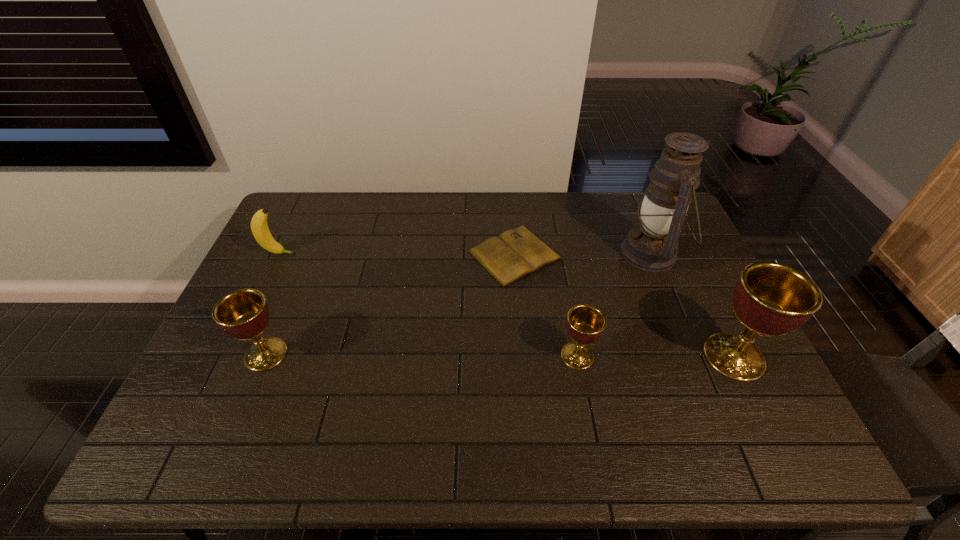
Point out which chalice is positioned as the third nearest to the shortest object. Please provide its 2D coordinates. Your answer should be formatted as a tuple, i.e. [(x, y)], where the tuple contains the x and y coordinates of a point satisfying the conditions above.

[(243, 314)]

I want to click on chalice that is the second nearest to the second chalice from right to left, so click(x=243, y=314).

Identify the location of vacant space that satisfies the following two spatial constraints: 1. from the stem of the shortest object; 2. on the right side of the banana. (278, 255).

Identify the location of free spot that satisfies the following two spatial constraints: 1. from the stem of the banana; 2. on the right side of the leftmost chalice. Image resolution: width=960 pixels, height=540 pixels. 231,354.

This screenshot has height=540, width=960. What are the coordinates of `vacant space that satisfies the following two spatial constraints: 1. on the back side of the book; 2. from the stem of the banana` in the screenshot? It's located at (515, 254).

The width and height of the screenshot is (960, 540). I want to click on vacant space that satisfies the following two spatial constraints: 1. from the stem of the shortest chalice; 2. on the left side of the banana, so click(230, 356).

Where is `vacant space that satisfies the following two spatial constraints: 1. on the front side of the tallest object; 2. from the stem of the banana`? vacant space that satisfies the following two spatial constraints: 1. on the front side of the tallest object; 2. from the stem of the banana is located at coordinates (652, 254).

This screenshot has height=540, width=960. What are the coordinates of `free space that satisfies the following two spatial constraints: 1. from the stem of the banana; 2. on the right side of the second tallest chalice` in the screenshot? It's located at (231, 354).

At what (x,y) coordinates should I click in order to perform the action: click on blank area in the image that satisfies the following two spatial constraints: 1. from the stem of the second chalice from right to left; 2. on the left side of the banana. Please return your answer as a coordinate pair (x, y). The image size is (960, 540). Looking at the image, I should click on (230, 356).

Image resolution: width=960 pixels, height=540 pixels. Identify the location of vacant space that satisfies the following two spatial constraints: 1. on the back side of the oil lamp; 2. on the left side of the shortest chalice. (558, 253).